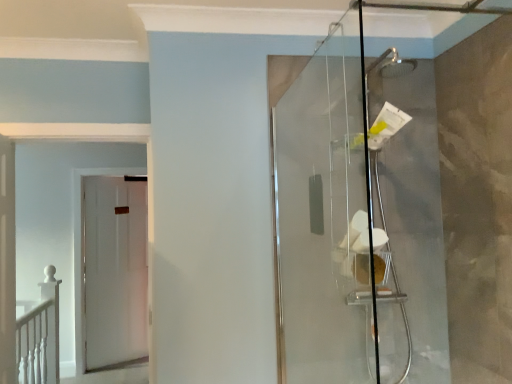
Question: Is white matte door at left, arranged as the first door when viewed from the front, taller than transparent glass shower door at right?

Choices:
 (A) yes
 (B) no

Answer: (B)

Question: Are white matte door at left, arranged as the first door when viewed from the front, and transparent glass shower door at right located far from each other?

Choices:
 (A) yes
 (B) no

Answer: (A)

Question: Is white matte door at left, the 2th door in the back-to-front sequence, wider than transparent glass shower door at right?

Choices:
 (A) no
 (B) yes

Answer: (B)

Question: Is white matte door at left, the 2th door in the back-to-front sequence, located outside transparent glass shower door at right?

Choices:
 (A) no
 (B) yes

Answer: (B)

Question: Is white matte door at left, the 2th door in the back-to-front sequence, in front of transparent glass shower door at right?

Choices:
 (A) no
 (B) yes

Answer: (A)

Question: Is white matte door at left, arranged as the first door when viewed from the front, bigger or smaller than white matte door at left, which appears as the 1th door when viewed from the back?

Choices:
 (A) small
 (B) big

Answer: (B)

Question: From a real-world perspective, is white matte door at left, the 2th door in the back-to-front sequence, physically located above or below white matte door at left, which appears as the 1th door when viewed from the back?

Choices:
 (A) below
 (B) above

Answer: (B)

Question: From the image's perspective, is white matte door at left, arranged as the first door when viewed from the front, located above or below white matte door at left, the 2th door from the front?

Choices:
 (A) above
 (B) below

Answer: (A)

Question: Based on their positions, is white matte door at left, the 2th door in the back-to-front sequence, located to the left or right of white matte door at left, which appears as the 1th door when viewed from the back?

Choices:
 (A) left
 (B) right

Answer: (B)

Question: In the image, is transparent glass shower door at right positioned in front of or behind white matte door at left, arranged as the first door when viewed from the front?

Choices:
 (A) front
 (B) behind

Answer: (A)

Question: Is transparent glass shower door at right to the left or to the right of white matte door at left, arranged as the first door when viewed from the front, in the image?

Choices:
 (A) right
 (B) left

Answer: (A)

Question: From a real-world perspective, is transparent glass shower door at right positioned above or below white matte door at left, the 2th door in the back-to-front sequence?

Choices:
 (A) above
 (B) below

Answer: (A)

Question: In terms of size, does transparent glass shower door at right appear bigger or smaller than white matte door at left, arranged as the first door when viewed from the front?

Choices:
 (A) small
 (B) big

Answer: (A)

Question: Is transparent glass shower door at right bigger or smaller than white matte door at left, the 2th door from the front?

Choices:
 (A) small
 (B) big

Answer: (A)

Question: Based on their positions, is transparent glass shower door at right located to the left or right of white matte door at left, which appears as the 1th door when viewed from the back?

Choices:
 (A) right
 (B) left

Answer: (A)